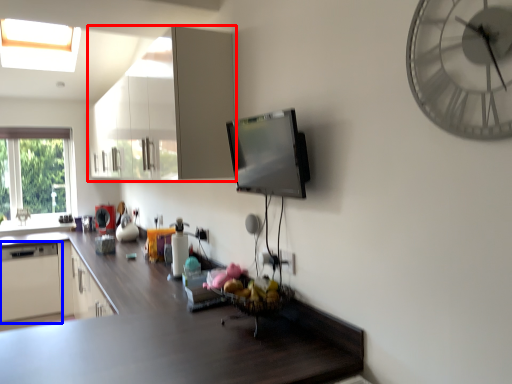
Question: Which point is further to the camera, cabinetry (highlighted by a red box) or appliance (highlighted by a blue box)?

Choices:
 (A) cabinetry
 (B) appliance

Answer: (B)